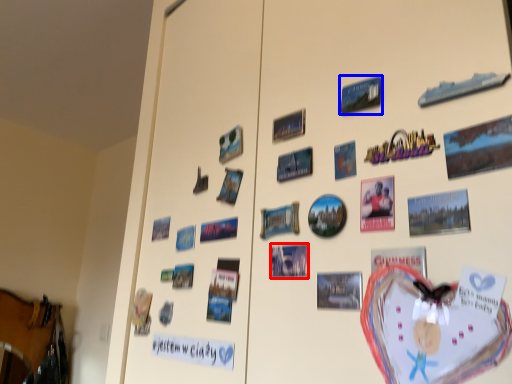
Question: Which of the following is the farthest to the observer, postcard (highlighted by a red box) or postcard (highlighted by a blue box)?

Choices:
 (A) postcard
 (B) postcard

Answer: (A)